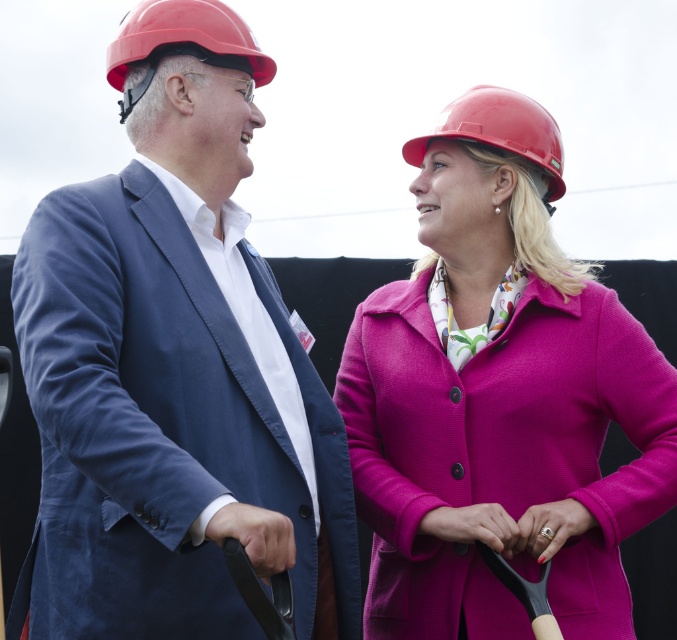
You are a photographer at a groundbreaking ceremony. You notice the black rubber handle at lower left and the pink fabric hand at center. Which object is positioned higher in the image?

The black rubber handle at lower left is located above the pink fabric hand at center, so it is positioned higher in the image.

You are a photographer at a groundbreaking event. You need to capture a closeup of the black rubber handle at lower left and the pink fabric hand at center. Which object should you zoom in on to ensure both fit in the frame without moving the camera?

The black rubber handle at lower left has a lesser width compared to the pink fabric hand at center, so you should zoom in on the pink fabric hand at center to ensure both fit in the frame without moving the camera.

You are a photographer at a groundbreaking event. You need to adjust your camera focus to capture both the pink woolen coat at center and the black rubber handle at lower left. Since the objects are at different heights, which one should you focus on first to ensure both are in frame?

The pink woolen coat at center is taller than the black rubber handle at lower left, so focusing on the taller object first will help ensure both are in frame.